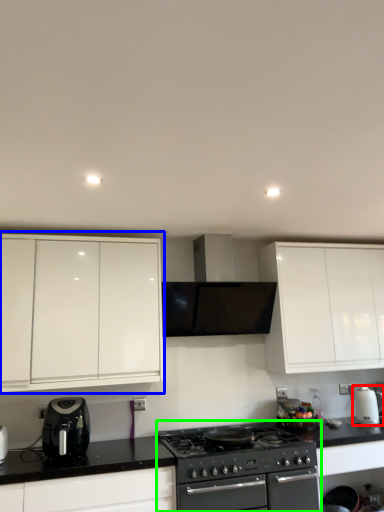
Question: Considering the real-world distances, which object is farthest from kitchen appliance (highlighted by a red box)? cabinetry (highlighted by a blue box) or appliance (highlighted by a green box)?

Choices:
 (A) cabinetry
 (B) appliance

Answer: (A)